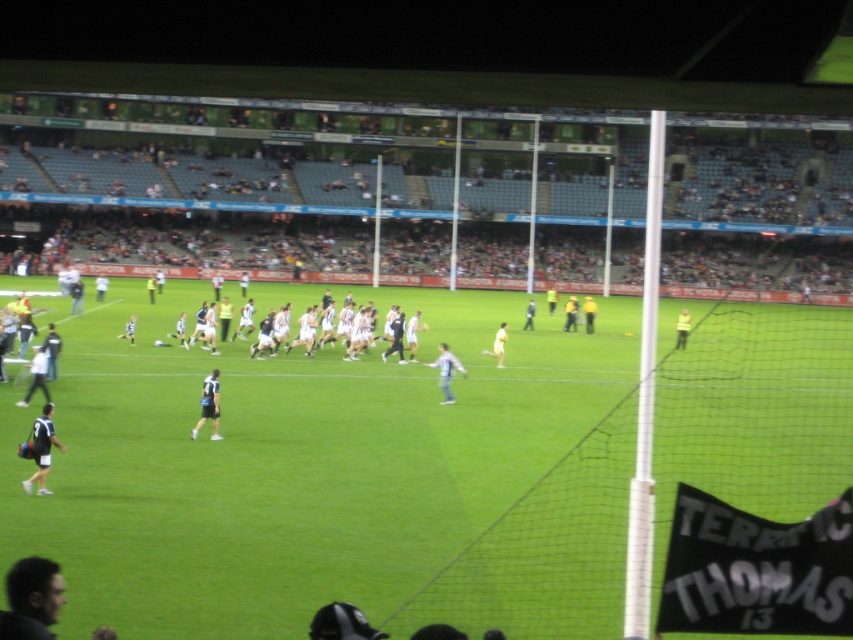
Question: Which is farther from the yellow reflective vest at center?

Choices:
 (A) dark brown hair at lower left
 (B) dark blue jersey at lower left
 (C) white jersey at center

Answer: (A)

Question: Which point appears closest to the camera in this image?

Choices:
 (A) (677, 314)
 (B) (199, 424)
 (C) (367, 584)
 (D) (498, 344)

Answer: (C)

Question: Is dark brown hair at lower left to the right of yellow reflective vest at center from the viewer's perspective?

Choices:
 (A) no
 (B) yes

Answer: (A)

Question: Observing the image, what is the correct spatial positioning of dark brown hair at lower left in reference to white jersey at center?

Choices:
 (A) right
 (B) left

Answer: (A)

Question: Can you confirm if green grass field at center is bigger than white fabric shirt at center?

Choices:
 (A) no
 (B) yes

Answer: (B)

Question: Which is farther from the white jersey at center?

Choices:
 (A) white fabric shirt at center
 (B) yellow reflective vest at center
 (C) dark blue jersey at lower left
 (D) white matte jersey at center

Answer: (D)